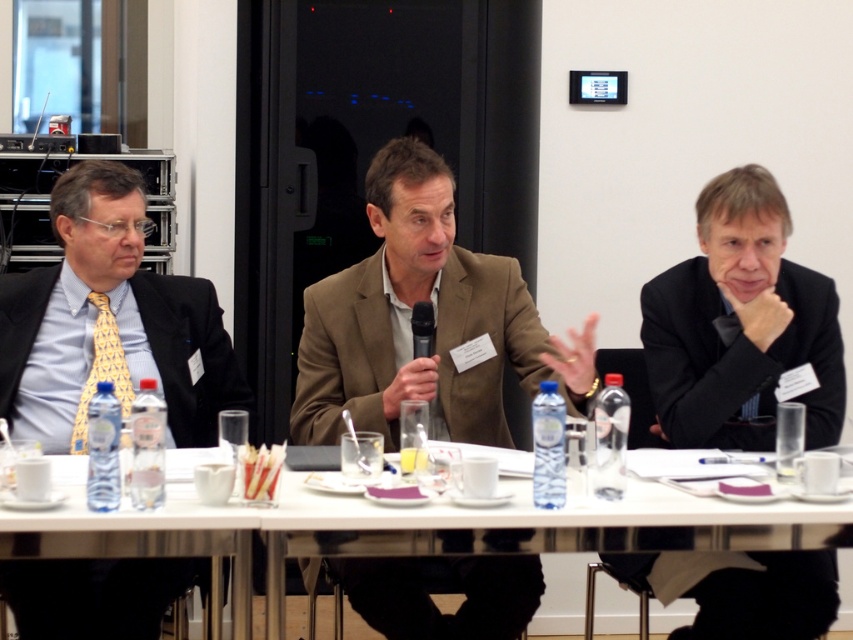
Can you confirm if matte black suit at left is positioned to the left of yellowgeometric patterned fabrictie at left?

No, matte black suit at left is not to the left of yellowgeometric patterned fabrictie at left.

What do you see at coordinates (91, 596) in the screenshot? I see `matte black suit at left` at bounding box center [91, 596].

You are a GUI agent. You are given a task and a screenshot of the screen. Output one action in this format:
    pyautogui.click(x=<x>, y=<y>)
    Task: Click on the matte black suit at left
    
    Given the screenshot: What is the action you would take?
    pyautogui.click(x=91, y=596)

Can you confirm if white plastic table at center is shorter than black matte suit at right?

Correct, white plastic table at center is not as tall as black matte suit at right.

Between white plastic table at center and black matte suit at right, which one appears on the right side from the viewer's perspective?

black matte suit at right

At what (x,y) coordinates should I click in order to perform the action: click on white plastic table at center. Please return your answer as a coordinate pair (x, y). Looking at the image, I should click on (398, 529).

Is the position of brown textured suit at center more distant than that of black matte suit at right?

No, brown textured suit at center is closer to the viewer.

Between brown textured suit at center and black matte suit at right, which one has more height?

brown textured suit at center

Describe the element at coordinates (347, 355) in the screenshot. I see `brown textured suit at center` at that location.

Find the location of a particular element. brown textured suit at center is located at coordinates (347, 355).